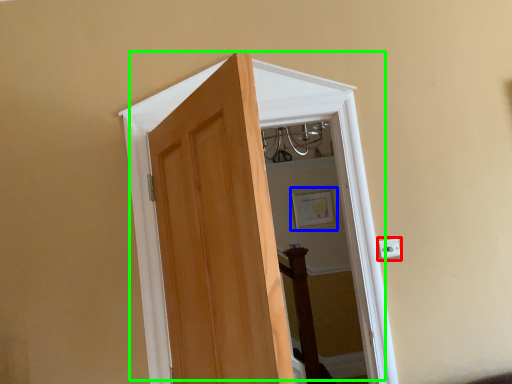
Question: Which object is positioned closest to electric outlet (highlighted by a red box)? Select from picture frame (highlighted by a blue box) and door (highlighted by a green box).

Choices:
 (A) picture frame
 (B) door

Answer: (B)